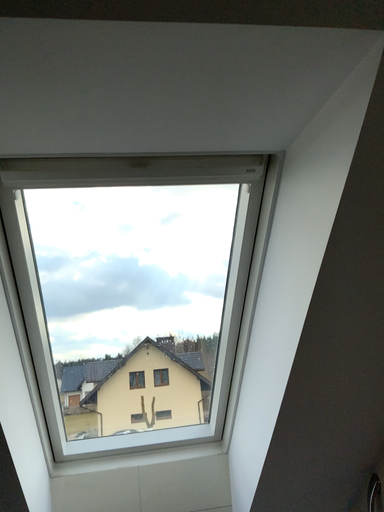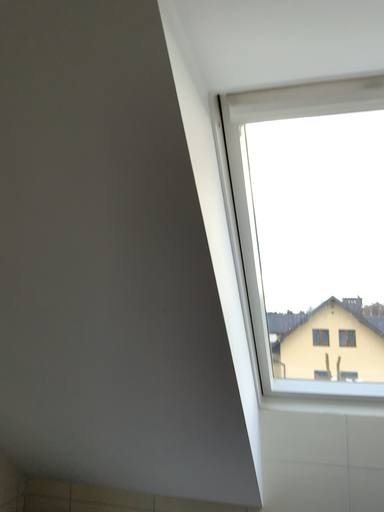
Question: Which way did the camera rotate in the video?

Choices:
 (A) rotated left
 (B) rotated right

Answer: (A)